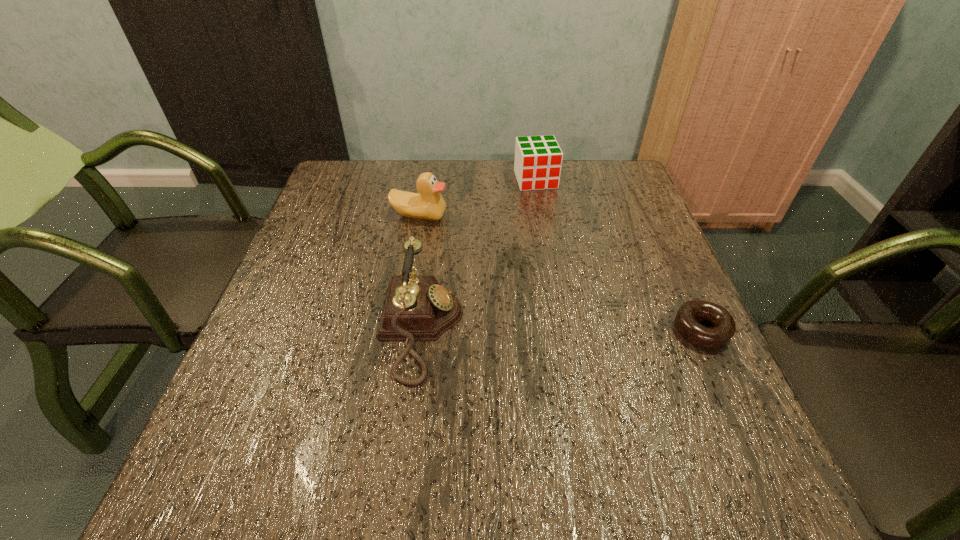
Identify the location of vacant space located 0.170m at the beak of the duck. (468, 260).

You are a GUI agent. You are given a task and a screenshot of the screen. Output one action in this format:
    pyautogui.click(x=<x>, y=<y>)
    Task: Click on the vacant space located 0.270m on the red face of the cube
    
    Given the screenshot: What is the action you would take?
    pyautogui.click(x=564, y=253)

Where is `free region located on the red face of the cube`? This screenshot has width=960, height=540. free region located on the red face of the cube is located at coordinates (568, 267).

Locate an element on the screen. The height and width of the screenshot is (540, 960). vacant space located on the red face of the cube is located at coordinates (554, 227).

Identify the location of object that is at the far edge. The height and width of the screenshot is (540, 960). (538, 160).

Identify the location of object at the right edge. Image resolution: width=960 pixels, height=540 pixels. (724, 327).

In the image, there is a desktop. At what (x,y) coordinates should I click in order to perform the action: click on vacant space at the far edge. Please return your answer as a coordinate pair (x, y). This screenshot has height=540, width=960. Looking at the image, I should click on (393, 163).

The width and height of the screenshot is (960, 540). Identify the location of free space at the near edge of the desktop. pos(509,393).

At what (x,y) coordinates should I click in order to perform the action: click on vacant space at the left edge. Please return your answer as a coordinate pair (x, y). Image resolution: width=960 pixels, height=540 pixels. Looking at the image, I should click on (308, 218).

In the image, there is a desktop. At what (x,y) coordinates should I click in order to perform the action: click on free space at the right edge. Please return your answer as a coordinate pair (x, y). Looking at the image, I should click on (612, 265).